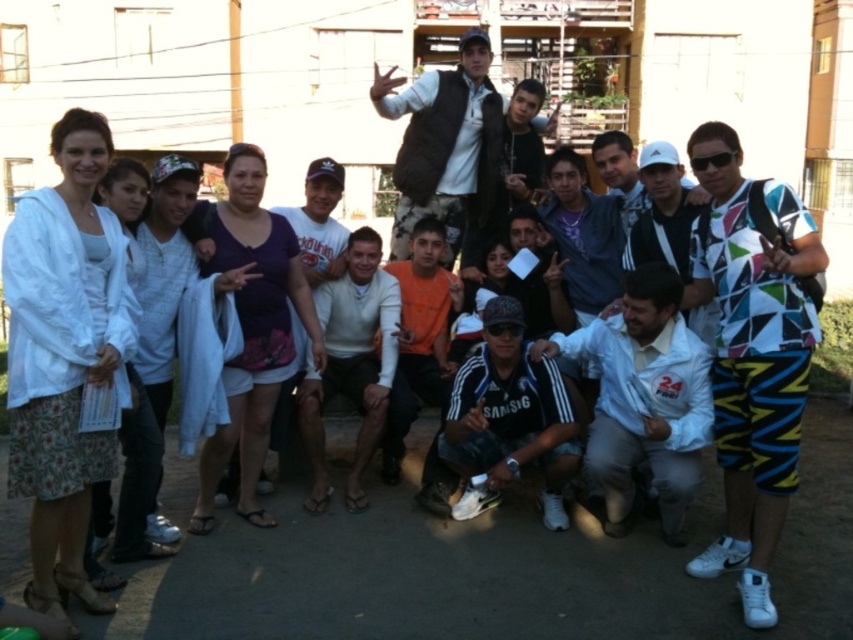
Question: Where is multicolored geometric shirt at center located in relation to white adidas cap at center in the image?

Choices:
 (A) left
 (B) right

Answer: (A)

Question: Is white matte jacket at lower right smaller than white sweater at center?

Choices:
 (A) yes
 (B) no

Answer: (B)

Question: Which point is farther to the camera?

Choices:
 (A) white cap at center
 (B) multicolored geometric shirt at center
 (C) black adidas jersey at center

Answer: (A)

Question: Which of the following is the farthest from the observer?

Choices:
 (A) black adidas jersey at center
 (B) white sweater at center
 (C) multicolored geometric shirt at center

Answer: (B)

Question: Is white matte jacket at lower right to the right of orange jersey at center from the viewer's perspective?

Choices:
 (A) yes
 (B) no

Answer: (A)

Question: Which point is closer to the camera?

Choices:
 (A) brown suede vest at upper center
 (B) orange jersey at center
 (C) white adidas cap at center

Answer: (C)